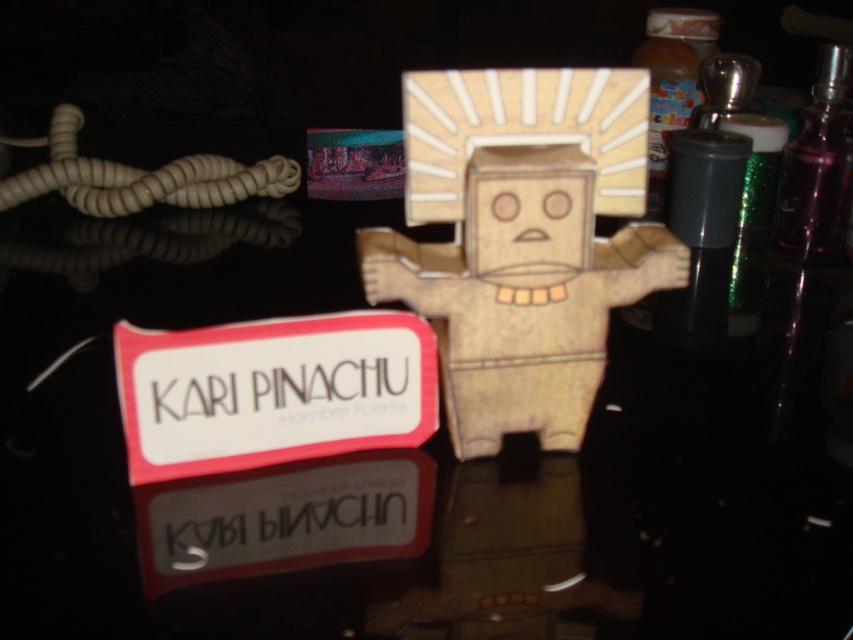
You are a collector who wants to display both the wooden figure at center and the metallic purple bottle at upper right on a shelf. Which object should you place first to ensure they both fit?

The wooden figure at center is larger in size than the metallic purple bottle at upper right, so you should place the wooden figure at center first to ensure there is enough space for both objects.